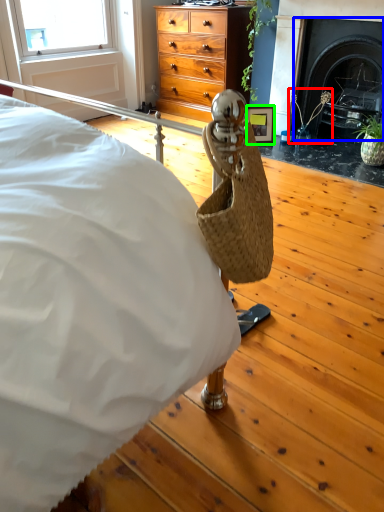
Question: Which object is the closest to the plant (highlighted by a red box)? Choose among these: fireplace (highlighted by a blue box) or picture frame (highlighted by a green box).

Choices:
 (A) fireplace
 (B) picture frame

Answer: (A)